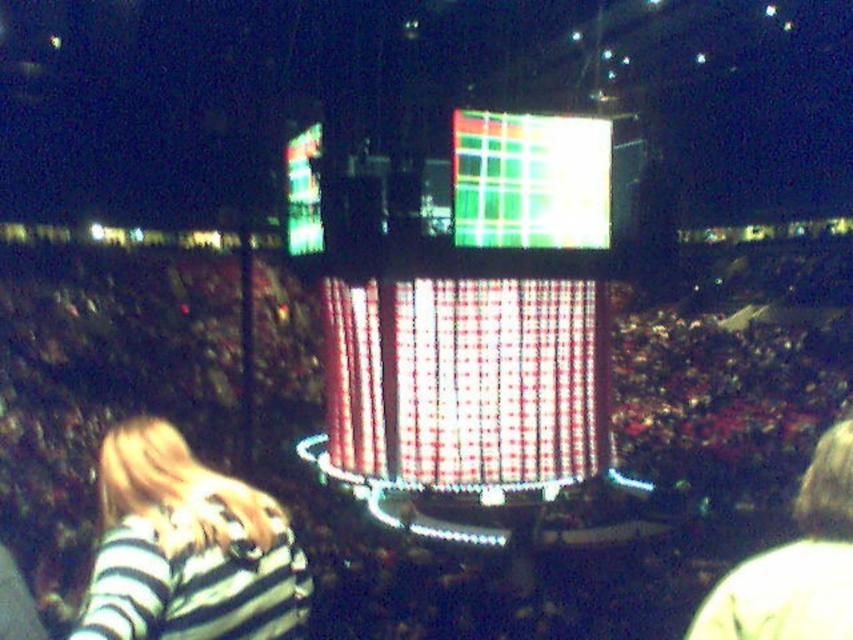
You are at a concert and want to find a spot where you can see the stage clearly. The stage is in the center of the image. There is a point marked at coordinates (616, 451) which is labeled as black fabric crowd at center. Where should you avoid standing to have an unobstructed view of the stage?

You should avoid standing at the point marked as black fabric crowd at center at (616, 451) because that area is densely packed with people, obstructing the view of the stage.

You are a stagehand at the concert. You need to hang a banner that requires 3 meters of vertical space. The banner must be placed between the black fabric crowd at center and the shiny plastic screen at center. Can the space between them accommodate the banner?

The black fabric crowd at center is much taller than the shiny plastic screen at center. Since the banner requires 3 meters of vertical space, it depends on the actual height difference between them. However, without specific measurements, we cannot confirm if the vertical space between them is sufficient for the banner.